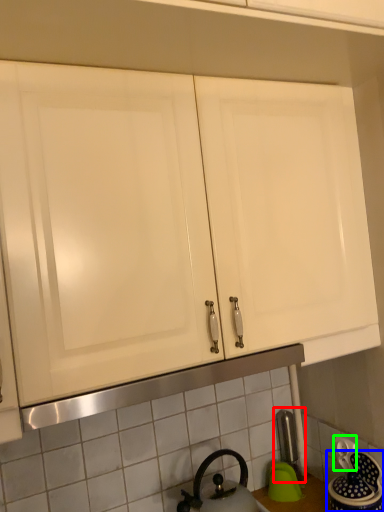
Question: Considering the real-world distances, which object is farthest from faucet (highlighted by a red box)? appliance (highlighted by a blue box) or electric outlet (highlighted by a green box)?

Choices:
 (A) appliance
 (B) electric outlet

Answer: (A)